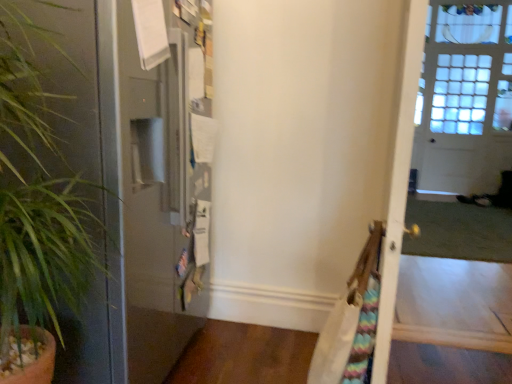
I want to click on clear glass screen door at right, so click(x=465, y=98).

What do you see at coordinates (465, 98) in the screenshot?
I see `clear glass screen door at right` at bounding box center [465, 98].

This screenshot has height=384, width=512. What do you see at coordinates (88, 172) in the screenshot?
I see `green leafy plant at left` at bounding box center [88, 172].

Find the location of a particular element. green leafy plant at left is located at coordinates (88, 172).

The image size is (512, 384). Find the location of `clear glass screen door at right`. clear glass screen door at right is located at coordinates (465, 98).

Considering the relative positions of green leafy plant at left and clear glass screen door at right in the image provided, is green leafy plant at left to the left or to the right of clear glass screen door at right?

Based on their positions, green leafy plant at left is located to the left of clear glass screen door at right.

In the scene shown: Between green leafy plant at left and clear glass screen door at right, which one is positioned in front?

green leafy plant at left is in front.

Considering the positions of points (115, 209) and (475, 170), is point (115, 209) closer to camera compared to point (475, 170)?

Yes.

From the image's perspective, between green leafy plant at left and clear glass screen door at right, which one is located above?

clear glass screen door at right, from the image's perspective.

From a real-world perspective, is green leafy plant at left on top of clear glass screen door at right?

Actually, green leafy plant at left is physically below clear glass screen door at right in the real world.

Does green leafy plant at left have a greater width compared to clear glass screen door at right?

Correct, the width of green leafy plant at left exceeds that of clear glass screen door at right.

Who is shorter, green leafy plant at left or clear glass screen door at right?

green leafy plant at left is shorter.

Consider the image. Is green leafy plant at left smaller than clear glass screen door at right?

Yes.

Choose the correct answer: Is green leafy plant at left inside clear glass screen door at right or outside it?

green leafy plant at left lies outside clear glass screen door at right.

Is green leafy plant at left not close to clear glass screen door at right?

Yes, green leafy plant at left is far from clear glass screen door at right.

Does green leafy plant at left turn towards clear glass screen door at right?

No, green leafy plant at left does not turn towards clear glass screen door at right.

Identify the location of houseplant in front of the clear glass screen door at right. (88, 172).

Considering the positions of objects clear glass screen door at right and green leafy plant at left in the image provided, who is more to the right, clear glass screen door at right or green leafy plant at left?

clear glass screen door at right is more to the right.

Who is more distant, clear glass screen door at right or green leafy plant at left?

clear glass screen door at right is further from the camera.

Which is in front, point (442, 158) or point (116, 186)?

Positioned in front is point (116, 186).

From the image's perspective, is clear glass screen door at right beneath green leafy plant at left?

Actually, clear glass screen door at right appears above green leafy plant at left in the image.

From a real-world perspective, is clear glass screen door at right above or below green leafy plant at left?

In terms of real-world spatial position, clear glass screen door at right is above green leafy plant at left.

Which object is thinner, clear glass screen door at right or green leafy plant at left?

clear glass screen door at right.

Considering the sizes of clear glass screen door at right and green leafy plant at left in the image, is clear glass screen door at right taller or shorter than green leafy plant at left?

Considering their sizes, clear glass screen door at right has more height than green leafy plant at left.

Looking at the image, does clear glass screen door at right seem bigger or smaller compared to green leafy plant at left?

Clearly, clear glass screen door at right is larger in size than green leafy plant at left.

Consider the image. Choose the correct answer: Is clear glass screen door at right inside green leafy plant at left or outside it?

clear glass screen door at right exists outside the volume of green leafy plant at left.

Is clear glass screen door at right in contact with green leafy plant at left?

clear glass screen door at right and green leafy plant at left are not in contact.

Is clear glass screen door at right looking in the opposite direction of green leafy plant at left?

clear glass screen door at right is not turned away from green leafy plant at left.

How many degrees apart are the facing directions of clear glass screen door at right and green leafy plant at left?

89.2 degrees separate the facing orientations of clear glass screen door at right and green leafy plant at left.

Identify the location of houseplant below the clear glass screen door at right (from the image's perspective). This screenshot has height=384, width=512. (88, 172).

This screenshot has height=384, width=512. I want to click on houseplant in front of the clear glass screen door at right, so click(88, 172).

Find the location of a particular element. The height and width of the screenshot is (384, 512). houseplant to the left of clear glass screen door at right is located at coordinates (88, 172).